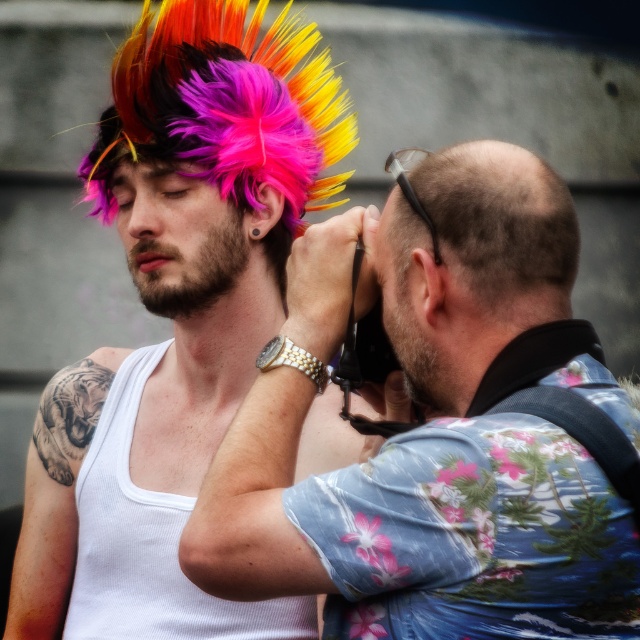
Which is more to the left, floral print shirt at right or floral-patterned shirt at right?

Positioned to the left is floral-patterned shirt at right.

Which is above, floral print shirt at right or floral-patterned shirt at right?

Positioned higher is floral-patterned shirt at right.

Who is more distant from viewer, (x=461, y=580) or (x=388, y=228)?

The point (x=388, y=228) is more distant.

In order to click on floral print shirt at right in this screenshot , I will do `click(476, 536)`.

Does multicolored feathered wig at center appear over floral print shirt at right?

Yes, multicolored feathered wig at center is above floral print shirt at right.

Between point (300, 465) and point (554, 445), which one is positioned behind?

The point (300, 465) is behind.

At what (x,y) coordinates should I click in order to perform the action: click on multicolored feathered wig at center. Please return your answer as a coordinate pair (x, y). The height and width of the screenshot is (640, 640). Looking at the image, I should click on (177, 317).

Does floral-patterned shirt at center have a smaller size compared to floral print shirt at right?

Incorrect, floral-patterned shirt at center is not smaller in size than floral print shirt at right.

Who is more distant from viewer, [444,264] or [376,627]?

The point [444,264] is more distant.

Which is behind, point (420, 588) or point (465, 477)?

Point (420, 588)

Locate an element on the screen. floral-patterned shirt at center is located at coordinates (435, 428).